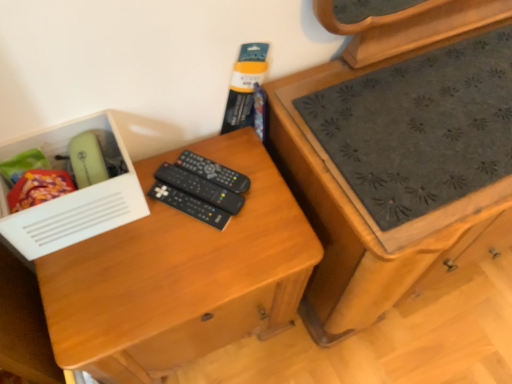
This screenshot has height=384, width=512. In order to click on free location in front of black plastic remote controls at center, positioned as the third remote control in bottom-to-top order in this screenshot , I will do `click(203, 252)`.